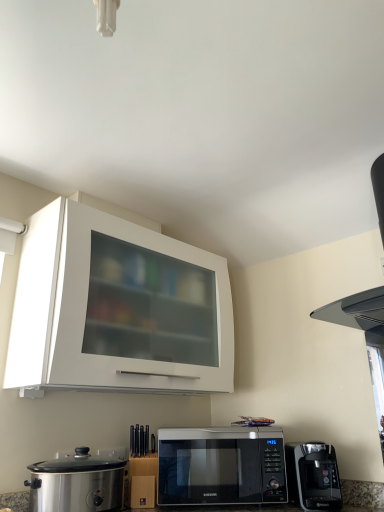
The height and width of the screenshot is (512, 384). Describe the element at coordinates (313, 476) in the screenshot. I see `black plastic coffee maker at lower right` at that location.

What do you see at coordinates (77, 483) in the screenshot?
I see `stainless steel slow cooker at lower left` at bounding box center [77, 483].

Where is `black glossy microwave at lower center`? The height and width of the screenshot is (512, 384). black glossy microwave at lower center is located at coordinates (221, 466).

Locate an element on the screen. black plastic coffee maker at lower right is located at coordinates (313, 476).

From a real-world perspective, between black matte vent at upper right and black plastic coffee maker at lower right, who is vertically lower?

black plastic coffee maker at lower right, from a real-world perspective.

What's the angular difference between black matte vent at upper right and black plastic coffee maker at lower right's facing directions?

There is a 42.5-degree angle between the facing directions of black matte vent at upper right and black plastic coffee maker at lower right.

Is black matte vent at upper right facing towards black plastic coffee maker at lower right?

No.

Is black matte vent at upper right positioned behind black plastic coffee maker at lower right?

No, it is in front of black plastic coffee maker at lower right.

How much distance is there between white glossy cabinet at upper center and black plastic coffee maker at lower right?

white glossy cabinet at upper center and black plastic coffee maker at lower right are 84.44 centimeters apart from each other.

Considering the sizes of objects white glossy cabinet at upper center and black plastic coffee maker at lower right in the image provided, who is bigger, white glossy cabinet at upper center or black plastic coffee maker at lower right?

white glossy cabinet at upper center is bigger.

Is white glossy cabinet at upper center oriented towards black plastic coffee maker at lower right?

No, white glossy cabinet at upper center is not facing towards black plastic coffee maker at lower right.

From a real-world perspective, is white glossy cabinet at upper center above or below black plastic coffee maker at lower right?

Clearly, from a real-world perspective, white glossy cabinet at upper center is above black plastic coffee maker at lower right.

Considering the points (236, 457) and (297, 490), which point is behind, point (236, 457) or point (297, 490)?

The point (236, 457) is behind.

Is black plastic coffee maker at lower right a part of black glossy microwave at lower center?

That's incorrect, black plastic coffee maker at lower right is not inside black glossy microwave at lower center.

From the image's perspective, which one is positioned lower, black glossy microwave at lower center or black plastic coffee maker at lower right?

black glossy microwave at lower center is shown below in the image.

From a real-world perspective, is black glossy microwave at lower center physically below black plastic coffee maker at lower right?

Incorrect, from a real-world perspective, black glossy microwave at lower center is higher than black plastic coffee maker at lower right.

Consider the image. Is black plastic coffee maker at lower right completely or partially outside of black matte vent at upper right?

black plastic coffee maker at lower right lies outside black matte vent at upper right's area.

Does black plastic coffee maker at lower right touch black matte vent at upper right?

No.

From a real-world perspective, does black plastic coffee maker at lower right sit lower than black matte vent at upper right?

Yes, from a real-world perspective, black plastic coffee maker at lower right is under black matte vent at upper right.

How far apart are white glossy cabinet at upper center and black glossy microwave at lower center?

The distance of white glossy cabinet at upper center from black glossy microwave at lower center is 20.38 inches.

How many degrees apart are the facing directions of white glossy cabinet at upper center and black glossy microwave at lower center?

The angular difference between white glossy cabinet at upper center and black glossy microwave at lower center is 42.7 degrees.

Which is behind, point (88, 314) or point (227, 493)?

The point (227, 493) is more distant.

Is white glossy cabinet at upper center next to black glossy microwave at lower center?

They are not placed beside each other.

Can you confirm if black glossy microwave at lower center is smaller than stainless steel slow cooker at lower left?

No, black glossy microwave at lower center is not smaller than stainless steel slow cooker at lower left.

From the image's perspective, which is below, black glossy microwave at lower center or stainless steel slow cooker at lower left?

black glossy microwave at lower center appears lower in the image.

Measure the distance from black glossy microwave at lower center to stainless steel slow cooker at lower left.

A distance of 15.09 inches exists between black glossy microwave at lower center and stainless steel slow cooker at lower left.

Would you say black glossy microwave at lower center is a long distance from stainless steel slow cooker at lower left?

black glossy microwave at lower center is actually quite close to stainless steel slow cooker at lower left.

Can you confirm if black matte vent at upper right is wider than stainless steel slow cooker at lower left?

Indeed, black matte vent at upper right has a greater width compared to stainless steel slow cooker at lower left.

Is point (374, 298) closer or farther from the camera than point (47, 477)?

Point (374, 298) is positioned farther from the camera compared to point (47, 477).

Could you tell me if black matte vent at upper right is turned towards stainless steel slow cooker at lower left?

No, black matte vent at upper right is not aimed at stainless steel slow cooker at lower left.

The width and height of the screenshot is (384, 512). In order to click on vent above the black plastic coffee maker at lower right (from the image's perspective) in this screenshot , I will do `click(358, 313)`.

Image resolution: width=384 pixels, height=512 pixels. What are the coordinates of `coffee maker located on the right of white glossy cabinet at upper center` in the screenshot? It's located at (313, 476).

Which object lies nearer to the anchor point white glossy cabinet at upper center, black glossy microwave at lower center or stainless steel slow cooker at lower left?

Among the two, black glossy microwave at lower center is located nearer to white glossy cabinet at upper center.

Based on their spatial positions, is black glossy microwave at lower center or black plastic coffee maker at lower right further from stainless steel slow cooker at lower left?

black plastic coffee maker at lower right is further to stainless steel slow cooker at lower left.

When comparing their distances from black glossy microwave at lower center, does stainless steel slow cooker at lower left or black matte vent at upper right seem closer?

stainless steel slow cooker at lower left lies closer to black glossy microwave at lower center than the other object.

When comparing their distances from black plastic coffee maker at lower right, does black glossy microwave at lower center or white glossy cabinet at upper center seem closer?

black glossy microwave at lower center is closer to black plastic coffee maker at lower right.

When comparing their distances from black plastic coffee maker at lower right, does white glossy cabinet at upper center or black matte vent at upper right seem closer?

black matte vent at upper right lies closer to black plastic coffee maker at lower right than the other object.

Considering their positions, is white glossy cabinet at upper center positioned closer to black glossy microwave at lower center than black plastic coffee maker at lower right?

black plastic coffee maker at lower right.

Estimate the real-world distances between objects in this image. Which object is closer to stainless steel slow cooker at lower left, black glossy microwave at lower center or white glossy cabinet at upper center?

Based on the image, black glossy microwave at lower center appears to be nearer to stainless steel slow cooker at lower left.

Based on their spatial positions, is black matte vent at upper right or white glossy cabinet at upper center closer to black plastic coffee maker at lower right?

black matte vent at upper right is positioned closer to the anchor black plastic coffee maker at lower right.

This screenshot has height=512, width=384. Find the location of `microwave oven located between white glossy cabinet at upper center and black plastic coffee maker at lower right in the left-right direction`. microwave oven located between white glossy cabinet at upper center and black plastic coffee maker at lower right in the left-right direction is located at coordinates (221, 466).

Where is `cabinetry between stainless steel slow cooker at lower left and black matte vent at upper right from left to right`? This screenshot has width=384, height=512. cabinetry between stainless steel slow cooker at lower left and black matte vent at upper right from left to right is located at coordinates (117, 308).

Locate an element on the screen. Image resolution: width=384 pixels, height=512 pixels. coffee maker that lies between black matte vent at upper right and black glossy microwave at lower center from top to bottom is located at coordinates (313, 476).

You are a GUI agent. You are given a task and a screenshot of the screen. Output one action in this format:
    pyautogui.click(x=<x>, y=<y>)
    Task: Click on the microwave oven between stainless steel slow cooker at lower left and black plastic coffee maker at lower right
    The height and width of the screenshot is (512, 384).
    Given the screenshot: What is the action you would take?
    pyautogui.click(x=221, y=466)